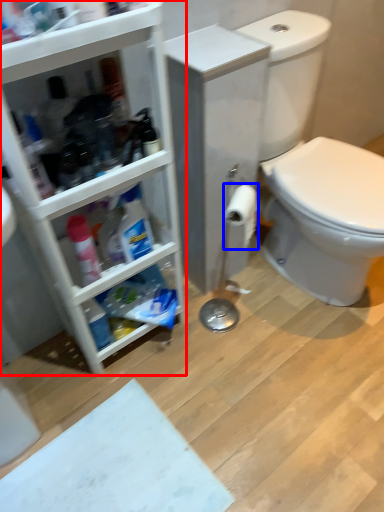
Question: Which object appears closest to the camera in this image, bathroom cabinet (highlighted by a red box) or toilet paper (highlighted by a blue box)?

Choices:
 (A) bathroom cabinet
 (B) toilet paper

Answer: (A)